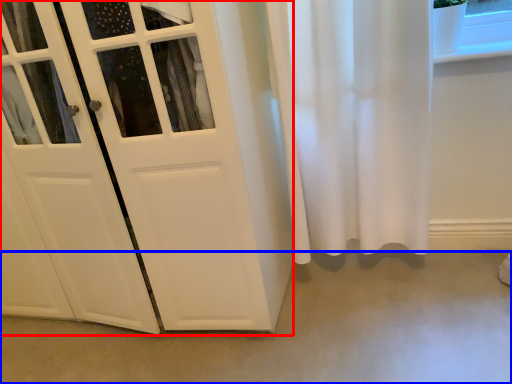
Question: Among these objects, which one is farthest to the camera, door (highlighted by a red box) or concrete (highlighted by a blue box)?

Choices:
 (A) door
 (B) concrete

Answer: (B)